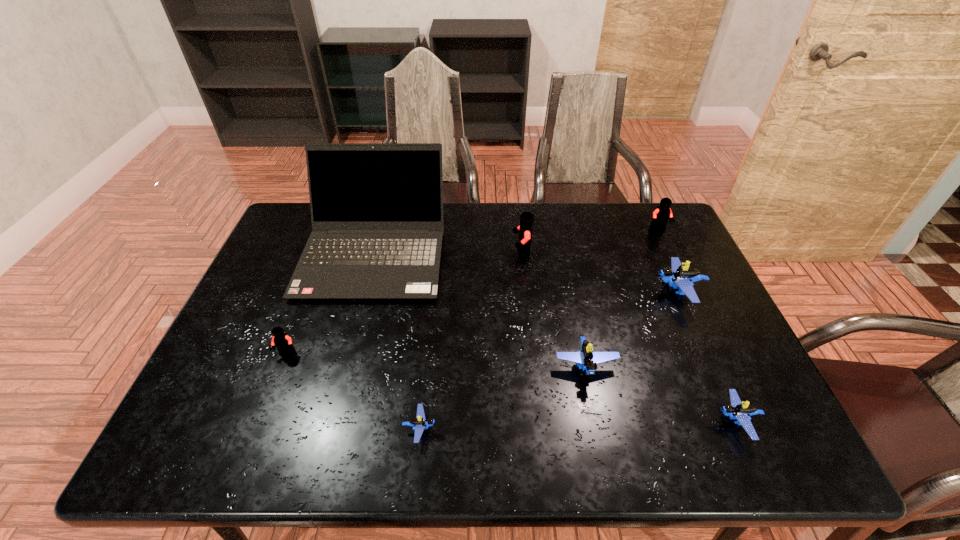
The image size is (960, 540). In order to click on free spot that satisfies the following two spatial constraints: 1. on the front-facing side of the second biggest black Lego; 2. on the front-facing side of the farthest blue Lego in this screenshot , I will do `click(687, 292)`.

Where is `vacant point that satisfies the following two spatial constraints: 1. on the front-facing side of the biggest black Lego; 2. on the front-facing side of the nearest black Lego`? This screenshot has height=540, width=960. vacant point that satisfies the following two spatial constraints: 1. on the front-facing side of the biggest black Lego; 2. on the front-facing side of the nearest black Lego is located at coordinates (532, 353).

At what (x,y) coordinates should I click in order to perform the action: click on vacant space that satisfies the following two spatial constraints: 1. on the front-facing side of the biggest blue Lego; 2. on the front-facing side of the fourth object from right to left. Please return your answer as a coordinate pair (x, y). Looking at the image, I should click on (711, 367).